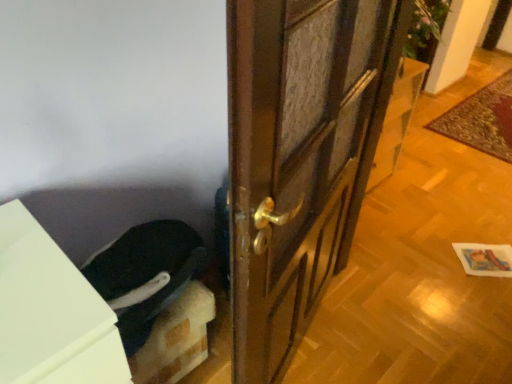
Question: Are carpeted mat at right and brown wooden door at center beside each other?

Choices:
 (A) yes
 (B) no

Answer: (B)

Question: Considering the relative positions of carpeted mat at right and brown wooden door at center in the image provided, is carpeted mat at right behind brown wooden door at center?

Choices:
 (A) yes
 (B) no

Answer: (A)

Question: Considering the relative sizes of carpeted mat at right and brown wooden door at center in the image provided, is carpeted mat at right wider than brown wooden door at center?

Choices:
 (A) yes
 (B) no

Answer: (B)

Question: Is carpeted mat at right smaller than brown wooden door at center?

Choices:
 (A) no
 (B) yes

Answer: (B)

Question: Is carpeted mat at right shorter than brown wooden door at center?

Choices:
 (A) no
 (B) yes

Answer: (A)

Question: Is carpeted mat at right at the left side of brown wooden door at center?

Choices:
 (A) yes
 (B) no

Answer: (B)

Question: From a real-world perspective, is dark blue fabric at lower left physically above white matte cabinet at lower left?

Choices:
 (A) yes
 (B) no

Answer: (A)

Question: From the image's perspective, is dark blue fabric at lower left on white matte cabinet at lower left?

Choices:
 (A) yes
 (B) no

Answer: (A)

Question: From the image's perspective, is dark blue fabric at lower left located beneath white matte cabinet at lower left?

Choices:
 (A) yes
 (B) no

Answer: (B)

Question: Can you confirm if dark blue fabric at lower left is wider than white matte cabinet at lower left?

Choices:
 (A) no
 (B) yes

Answer: (A)

Question: Considering the relative sizes of dark blue fabric at lower left and white matte cabinet at lower left in the image provided, is dark blue fabric at lower left thinner than white matte cabinet at lower left?

Choices:
 (A) yes
 (B) no

Answer: (A)

Question: Is the surface of dark blue fabric at lower left in direct contact with white matte cabinet at lower left?

Choices:
 (A) yes
 (B) no

Answer: (B)

Question: Is brown wooden door at center further to camera compared to dark blue fabric at lower left?

Choices:
 (A) yes
 (B) no

Answer: (A)